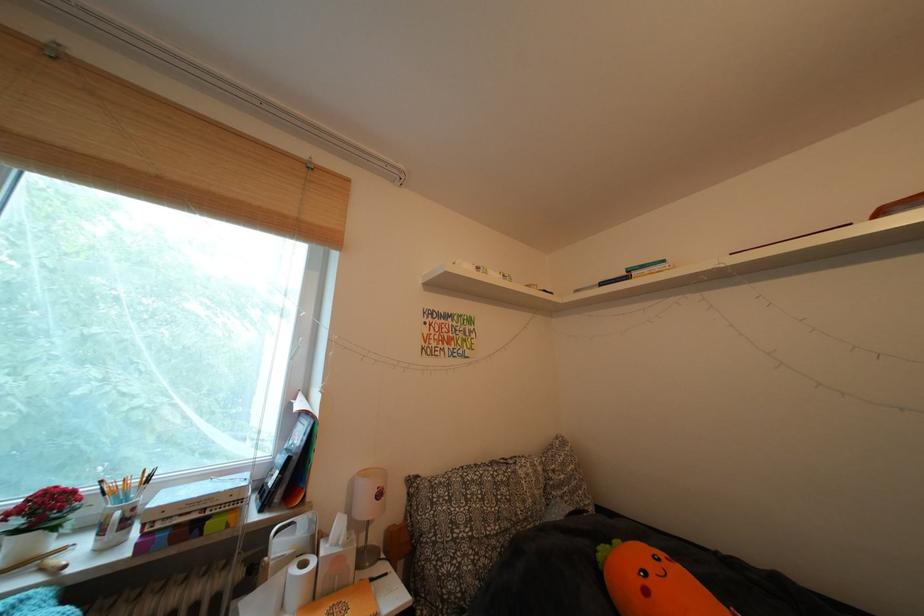
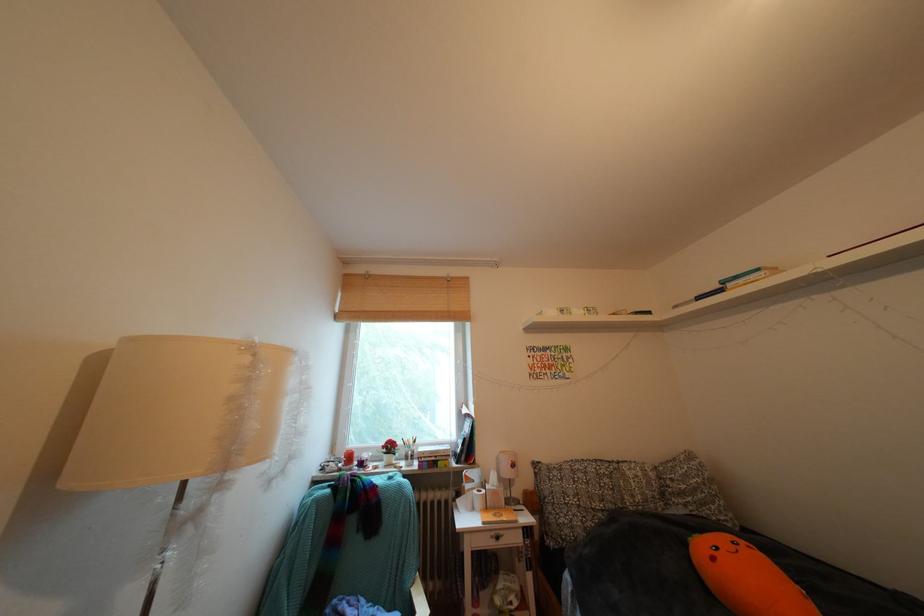
Where in the second image is the point corresponding to [564,477] from the first image?

(682, 485)